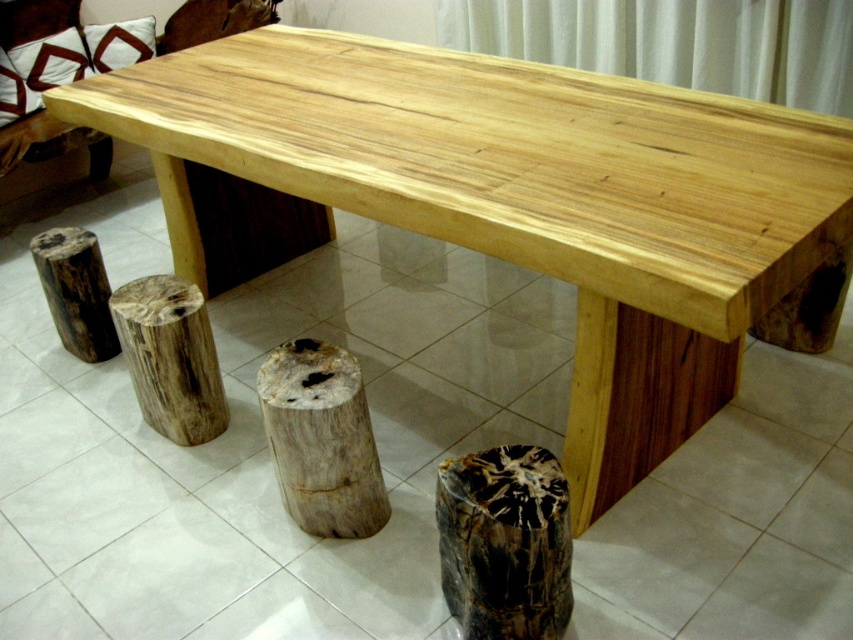
Question: Which point is closer to the camera?

Choices:
 (A) natural wood stump at lower center
 (B) brown rough wood stump at lower left
 (C) black petrified wood stump at lower center

Answer: (C)

Question: Does natural wood stump at center have a lesser width compared to natural wood stump at lower center?

Choices:
 (A) yes
 (B) no

Answer: (B)

Question: Which point is closer to the camera?

Choices:
 (A) black petrified wood stump at lower center
 (B) natural wood stump at lower center

Answer: (A)

Question: Where is natural wood stump at center located in relation to natural wood stump at lower center in the image?

Choices:
 (A) below
 (B) above

Answer: (A)

Question: Which of these objects is positioned closest to the natural wood stump at lower center?

Choices:
 (A) brown rough wood stump at lower left
 (B) natural wood stump at center

Answer: (A)

Question: Does black petrified wood stump at lower center have a larger size compared to brown rough wood stump at lower left?

Choices:
 (A) yes
 (B) no

Answer: (A)